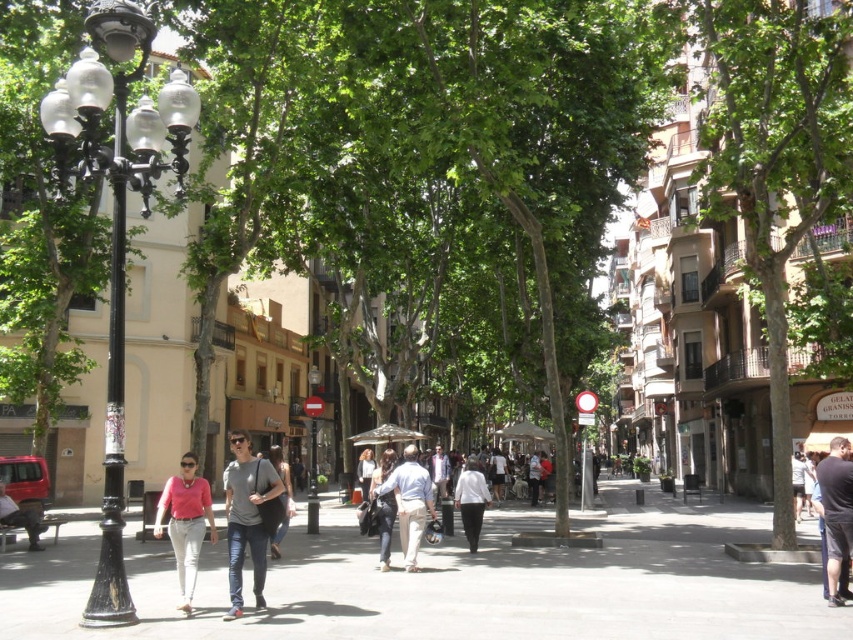
Question: Which of the following is the farthest from the observer?

Choices:
 (A) (33, 525)
 (B) (254, 497)

Answer: (A)

Question: Which of these objects is positioned closest to the dark gray jeans at center?

Choices:
 (A) black wrought iron lamp post at left
 (B) gray cotton t-shirt at center

Answer: (B)

Question: Among these points, which one is nearest to the camera?

Choices:
 (A) (468, 477)
 (B) (410, 444)

Answer: (A)

Question: Can you confirm if light beige pants at center is positioned to the right of white matte pants at center?

Choices:
 (A) no
 (B) yes

Answer: (A)

Question: Does green leafy tree at center have a larger size compared to light beige pants at center?

Choices:
 (A) no
 (B) yes

Answer: (B)

Question: Where is gray cotton t-shirt at center located in relation to dark gray pants at lower right in the image?

Choices:
 (A) right
 (B) left

Answer: (B)